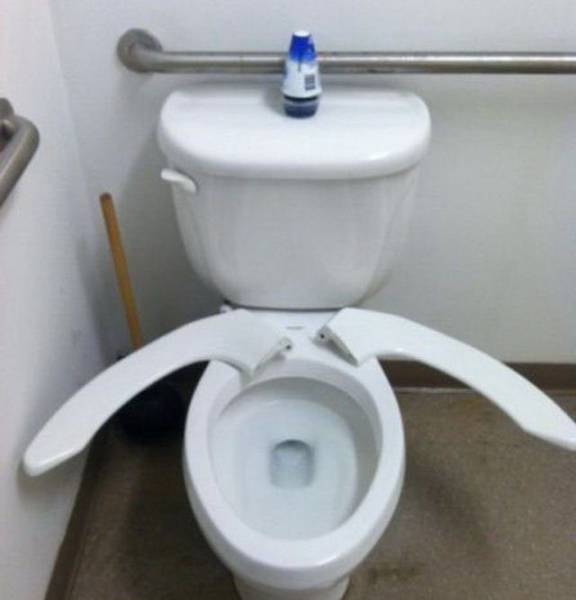
Find the location of a particular element. The width and height of the screenshot is (576, 600). right toilet seat half is located at coordinates (376, 337).